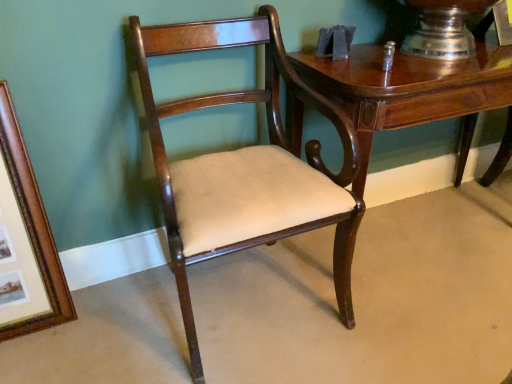
Image resolution: width=512 pixels, height=384 pixels. What are the coordinates of `free location in front of glossy wood table at upper right` in the screenshot? It's located at (x=431, y=315).